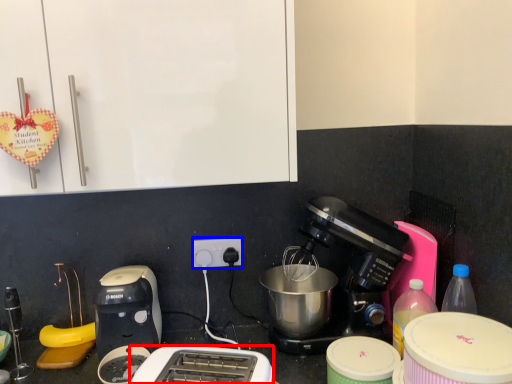
Question: Which of the following is the farthest to the observer, toaster (highlighted by a red box) or power plugs and sockets (highlighted by a blue box)?

Choices:
 (A) toaster
 (B) power plugs and sockets

Answer: (B)